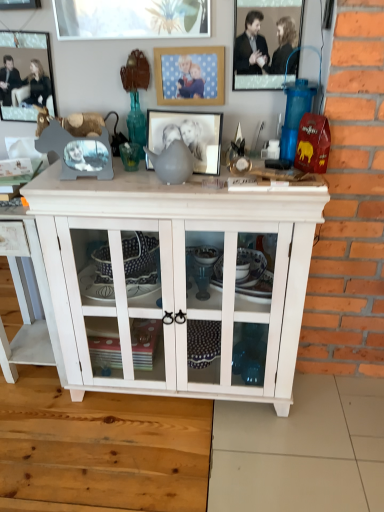
Locate an element on the screen. The image size is (384, 512). white wood cabinet at center, the 1th table in the left-to-right sequence is located at coordinates (27, 298).

Measure the distance between point (179, 67) and camera.

Point (179, 67) and camera are 1.45 meters apart from each other.

The image size is (384, 512). In order to click on brushed metal picture frame at upper left, the second picture frame from the left in this screenshot , I will do `click(19, 4)`.

The image size is (384, 512). Describe the element at coordinates (19, 4) in the screenshot. I see `brushed metal picture frame at upper left, arranged as the fourth picture frame when viewed from the right` at that location.

Measure the distance between point (46, 85) and camera.

Point (46, 85) and camera are 5.00 feet apart from each other.

What are the coordinates of `white wood cabinet at center, marked as the first table in a right-to-left arrangement` in the screenshot? It's located at (175, 275).

What do you see at coordinates (264, 42) in the screenshot?
I see `metallic silver picture frame at upper center, which ranks as the 1th picture frame in right-to-left order` at bounding box center [264, 42].

I want to click on metallic silver picture frame at upper center, the 5th picture frame viewed from the left, so click(x=264, y=42).

Locate an element on the screen. The width and height of the screenshot is (384, 512). white wood cabinet at center, the 2th table from the right is located at coordinates (27, 298).

From the image's perspective, which one is positioned lower, metallic silver picture frame at upper left, placed as the first picture frame when sorted from left to right, or white wood cabinet at center, marked as the first table in a right-to-left arrangement?

white wood cabinet at center, marked as the first table in a right-to-left arrangement.

Does metallic silver picture frame at upper left, the 5th picture frame viewed from the right, have a lesser height compared to white wood cabinet at center, acting as the 2th table starting from the left?

Indeed, metallic silver picture frame at upper left, the 5th picture frame viewed from the right, has a lesser height compared to white wood cabinet at center, acting as the 2th table starting from the left.

Who is smaller, metallic silver picture frame at upper left, placed as the first picture frame when sorted from left to right, or white wood cabinet at center, marked as the first table in a right-to-left arrangement?

Smaller between the two is metallic silver picture frame at upper left, placed as the first picture frame when sorted from left to right.

Are metallic silver picture frame at upper left, placed as the first picture frame when sorted from left to right, and white wood cabinet at center, marked as the first table in a right-to-left arrangement, located far from each other?

No, metallic silver picture frame at upper left, placed as the first picture frame when sorted from left to right, is not far away from white wood cabinet at center, marked as the first table in a right-to-left arrangement.

Which object is thinner, wooden picture frame at upper center, positioned as the second picture frame in right-to-left order, or matte gray picture frame at center, marked as the 3th picture frame in a right-to-left arrangement?

wooden picture frame at upper center, positioned as the second picture frame in right-to-left order.

From the image's perspective, which is below, wooden picture frame at upper center, marked as the fourth picture frame in a left-to-right arrangement, or matte gray picture frame at center, marked as the 3th picture frame in a left-to-right arrangement?

matte gray picture frame at center, marked as the 3th picture frame in a left-to-right arrangement, is shown below in the image.

Would you say wooden picture frame at upper center, positioned as the second picture frame in right-to-left order, is to the left or to the right of matte gray picture frame at center, marked as the 3th picture frame in a left-to-right arrangement, in the picture?

wooden picture frame at upper center, positioned as the second picture frame in right-to-left order, is positioned on matte gray picture frame at center, marked as the 3th picture frame in a left-to-right arrangement,'s right side.

Considering the relative sizes of white wood cabinet at center, acting as the 2th table starting from the left, and metallic silver picture frame at upper left, the 5th picture frame viewed from the right, in the image provided, is white wood cabinet at center, acting as the 2th table starting from the left, bigger than metallic silver picture frame at upper left, the 5th picture frame viewed from the right,?

Yes.

Considering the relative positions of white wood cabinet at center, acting as the 2th table starting from the left, and metallic silver picture frame at upper left, the 5th picture frame viewed from the right, in the image provided, is white wood cabinet at center, acting as the 2th table starting from the left, in front of metallic silver picture frame at upper left, the 5th picture frame viewed from the right,?

Yes, it is in front of metallic silver picture frame at upper left, the 5th picture frame viewed from the right.

From the white wood cabinet at center, marked as the first table in a right-to-left arrangement, count 5th picture frames backward and point to it. Please provide its 2D coordinates.

[(25, 75)]

Which object is closer to the camera taking this photo, metallic silver picture frame at upper center, which ranks as the 1th picture frame in right-to-left order, or wooden picture frame at upper center, marked as the fourth picture frame in a left-to-right arrangement?

metallic silver picture frame at upper center, which ranks as the 1th picture frame in right-to-left order, is in front.

Which object is positioned more to the right, metallic silver picture frame at upper center, the 5th picture frame viewed from the left, or wooden picture frame at upper center, positioned as the second picture frame in right-to-left order?

Positioned to the right is metallic silver picture frame at upper center, the 5th picture frame viewed from the left.

Is wooden picture frame at upper center, marked as the fourth picture frame in a left-to-right arrangement, completely or partially inside metallic silver picture frame at upper center, which ranks as the 1th picture frame in right-to-left order?

Definitely not — wooden picture frame at upper center, marked as the fourth picture frame in a left-to-right arrangement, is not inside metallic silver picture frame at upper center, which ranks as the 1th picture frame in right-to-left order.

Is metallic silver picture frame at upper center, the 5th picture frame viewed from the left, inside or outside of brushed metal picture frame at upper left, arranged as the fourth picture frame when viewed from the right?

metallic silver picture frame at upper center, the 5th picture frame viewed from the left, exists outside the volume of brushed metal picture frame at upper left, arranged as the fourth picture frame when viewed from the right.

From the image's perspective, would you say metallic silver picture frame at upper center, which ranks as the 1th picture frame in right-to-left order, is positioned over brushed metal picture frame at upper left, arranged as the fourth picture frame when viewed from the right?

Actually, metallic silver picture frame at upper center, which ranks as the 1th picture frame in right-to-left order, appears below brushed metal picture frame at upper left, arranged as the fourth picture frame when viewed from the right, in the image.

From a real-world perspective, between metallic silver picture frame at upper center, which ranks as the 1th picture frame in right-to-left order, and brushed metal picture frame at upper left, arranged as the fourth picture frame when viewed from the right, who is vertically lower?

metallic silver picture frame at upper center, which ranks as the 1th picture frame in right-to-left order, is physically lower.

Could you tell me if metallic silver picture frame at upper center, the 5th picture frame viewed from the left, is turned towards brushed metal picture frame at upper left, the second picture frame from the left?

No, metallic silver picture frame at upper center, the 5th picture frame viewed from the left, is not aimed at brushed metal picture frame at upper left, the second picture frame from the left.

What's the angular difference between matte gray picture frame at center, marked as the 3th picture frame in a right-to-left arrangement, and white wood cabinet at center, acting as the 2th table starting from the left,'s facing directions?

matte gray picture frame at center, marked as the 3th picture frame in a right-to-left arrangement, and white wood cabinet at center, acting as the 2th table starting from the left, are facing 10.2 degrees away from each other.

Does matte gray picture frame at center, marked as the 3th picture frame in a left-to-right arrangement, turn towards white wood cabinet at center, acting as the 2th table starting from the left?

No, matte gray picture frame at center, marked as the 3th picture frame in a left-to-right arrangement, does not turn towards white wood cabinet at center, acting as the 2th table starting from the left.

From a real-world perspective, is matte gray picture frame at center, marked as the 3th picture frame in a right-to-left arrangement, located higher than white wood cabinet at center, marked as the first table in a right-to-left arrangement?

Yes, from a real-world perspective, matte gray picture frame at center, marked as the 3th picture frame in a right-to-left arrangement, is above white wood cabinet at center, marked as the first table in a right-to-left arrangement.

From the image's perspective, which object appears higher, matte gray picture frame at center, marked as the 3th picture frame in a right-to-left arrangement, or white wood cabinet at center, acting as the 2th table starting from the left?

From the image's view, matte gray picture frame at center, marked as the 3th picture frame in a right-to-left arrangement, is above.

Consider the image. Does metallic silver picture frame at upper left, the 5th picture frame viewed from the right, have a greater height compared to white wood cabinet at center, the 2th table from the right?

In fact, metallic silver picture frame at upper left, the 5th picture frame viewed from the right, may be shorter than white wood cabinet at center, the 2th table from the right.

How distant is metallic silver picture frame at upper left, the 5th picture frame viewed from the right, from white wood cabinet at center, the 2th table from the right?

They are 23.46 inches apart.

Looking at this image, is metallic silver picture frame at upper left, placed as the first picture frame when sorted from left to right, at the right side of white wood cabinet at center, the 2th table from the right?

Correct, you'll find metallic silver picture frame at upper left, placed as the first picture frame when sorted from left to right, to the right of white wood cabinet at center, the 2th table from the right.

Based on the photo, how different are the orientations of metallic silver picture frame at upper left, the 5th picture frame viewed from the right, and white wood cabinet at center, the 2th table from the right, in degrees?

The facing directions of metallic silver picture frame at upper left, the 5th picture frame viewed from the right, and white wood cabinet at center, the 2th table from the right, are 0.308 degrees apart.

The height and width of the screenshot is (512, 384). Identify the location of table that is the 1st object directly below the metallic silver picture frame at upper left, placed as the first picture frame when sorted from left to right (from a real-world perspective). (175, 275).

Locate an element on the screen. the 2nd picture frame above the matte gray picture frame at center, marked as the 3th picture frame in a right-to-left arrangement (from a real-world perspective) is located at coordinates (189, 75).

Looking at the image, which one is located further to white wood cabinet at center, the 2th table from the right, brushed metal picture frame at upper left, the second picture frame from the left, or metallic silver picture frame at upper left, the 5th picture frame viewed from the right?

brushed metal picture frame at upper left, the second picture frame from the left, is further to white wood cabinet at center, the 2th table from the right.

Considering their positions, is white wood cabinet at center, the 2th table from the right, positioned further to wooden picture frame at upper center, marked as the fourth picture frame in a left-to-right arrangement, than brushed metal picture frame at upper left, arranged as the fourth picture frame when viewed from the right?

Based on the image, white wood cabinet at center, the 2th table from the right, appears to be further to wooden picture frame at upper center, marked as the fourth picture frame in a left-to-right arrangement.

Estimate the real-world distances between objects in this image. Which object is closer to white wood cabinet at center, the 1th table in the left-to-right sequence, metallic silver picture frame at upper center, which ranks as the 1th picture frame in right-to-left order, or wooden picture frame at upper center, marked as the fourth picture frame in a left-to-right arrangement?

wooden picture frame at upper center, marked as the fourth picture frame in a left-to-right arrangement, is positioned closer to the anchor white wood cabinet at center, the 1th table in the left-to-right sequence.

From the image, which object appears to be farther from white wood cabinet at center, acting as the 2th table starting from the left, wooden picture frame at upper center, marked as the fourth picture frame in a left-to-right arrangement, or white wood cabinet at center, the 1th table in the left-to-right sequence?

Among the two, wooden picture frame at upper center, marked as the fourth picture frame in a left-to-right arrangement, is located further to white wood cabinet at center, acting as the 2th table starting from the left.

Considering their positions, is metallic silver picture frame at upper left, the 5th picture frame viewed from the right, positioned closer to metallic silver picture frame at upper center, the 5th picture frame viewed from the left, than white wood cabinet at center, marked as the first table in a right-to-left arrangement?

Among the two, white wood cabinet at center, marked as the first table in a right-to-left arrangement, is located nearer to metallic silver picture frame at upper center, the 5th picture frame viewed from the left.

Which object lies further to the anchor point metallic silver picture frame at upper left, placed as the first picture frame when sorted from left to right, wooden picture frame at upper center, positioned as the second picture frame in right-to-left order, or brushed metal picture frame at upper left, the second picture frame from the left?

wooden picture frame at upper center, positioned as the second picture frame in right-to-left order, lies further to metallic silver picture frame at upper left, placed as the first picture frame when sorted from left to right, than the other object.

Based on their spatial positions, is brushed metal picture frame at upper left, arranged as the fourth picture frame when viewed from the right, or wooden picture frame at upper center, marked as the fourth picture frame in a left-to-right arrangement, further from white wood cabinet at center, the 1th table in the left-to-right sequence?

brushed metal picture frame at upper left, arranged as the fourth picture frame when viewed from the right, is positioned further to the anchor white wood cabinet at center, the 1th table in the left-to-right sequence.

Estimate the real-world distances between objects in this image. Which object is further from matte gray picture frame at center, marked as the 3th picture frame in a left-to-right arrangement, white wood cabinet at center, the 1th table in the left-to-right sequence, or brushed metal picture frame at upper left, arranged as the fourth picture frame when viewed from the right?

white wood cabinet at center, the 1th table in the left-to-right sequence, lies further to matte gray picture frame at center, marked as the 3th picture frame in a left-to-right arrangement, than the other object.

Locate an element on the screen. table between metallic silver picture frame at upper center, the 5th picture frame viewed from the left, and white wood cabinet at center, the 1th table in the left-to-right sequence, from top to bottom is located at coordinates (175, 275).

Identify the location of picture frame situated between metallic silver picture frame at upper left, placed as the first picture frame when sorted from left to right, and matte gray picture frame at center, marked as the 3th picture frame in a left-to-right arrangement, from left to right. Image resolution: width=384 pixels, height=512 pixels. (19, 4).

You are a GUI agent. You are given a task and a screenshot of the screen. Output one action in this format:
    pyautogui.click(x=<x>, y=<y>)
    Task: Click on the picture frame between wooden picture frame at upper center, positioned as the second picture frame in right-to-left order, and white wood cabinet at center, the 1th table in the left-to-right sequence, in the up-down direction
    The image size is (384, 512).
    Given the screenshot: What is the action you would take?
    pyautogui.click(x=188, y=136)

Where is `table between white wood cabinet at center, the 2th table from the right, and matte gray picture frame at center, marked as the 3th picture frame in a right-to-left arrangement, in the horizontal direction`? table between white wood cabinet at center, the 2th table from the right, and matte gray picture frame at center, marked as the 3th picture frame in a right-to-left arrangement, in the horizontal direction is located at coordinates (175, 275).